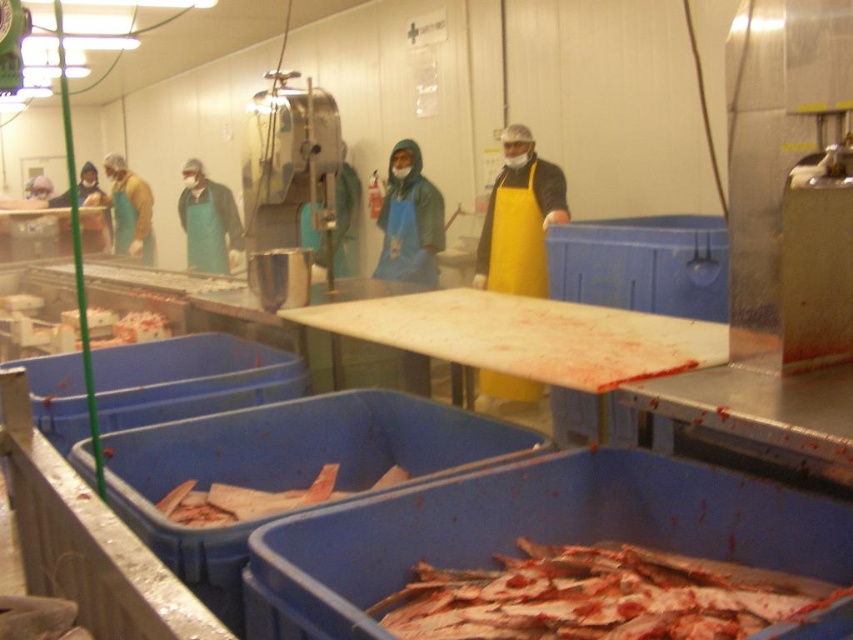
Is green apron at center wider than blue apron at left?

Yes, green apron at center is wider than blue apron at left.

Between point (234, 202) and point (32, 179), which one is positioned in front?

Point (234, 202) is in front.

At what (x,y) coordinates should I click in order to perform the action: click on green apron at center. Please return your answer as a coordinate pair (x, y). Looking at the image, I should click on (x=207, y=221).

Which of these two, yellow apron at center or blue apron at center, stands shorter?

With less height is yellow apron at center.

Can you confirm if yellow apron at center is smaller than blue apron at center?

No.

What do you see at coordinates (519, 218) in the screenshot? The image size is (853, 640). I see `yellow apron at center` at bounding box center [519, 218].

Locate an element on the screen. yellow apron at center is located at coordinates (519, 218).

Is shiny silver fish at lower center smaller than yellow apron at center?

Correct, shiny silver fish at lower center occupies less space than yellow apron at center.

Can you confirm if shiny silver fish at lower center is taller than yellow apron at center?

No, shiny silver fish at lower center is not taller than yellow apron at center.

Between point (706, 616) and point (517, 177), which one is positioned behind?

The point (517, 177) is more distant.

The height and width of the screenshot is (640, 853). What are the coordinates of `shiny silver fish at lower center` in the screenshot? It's located at [598, 596].